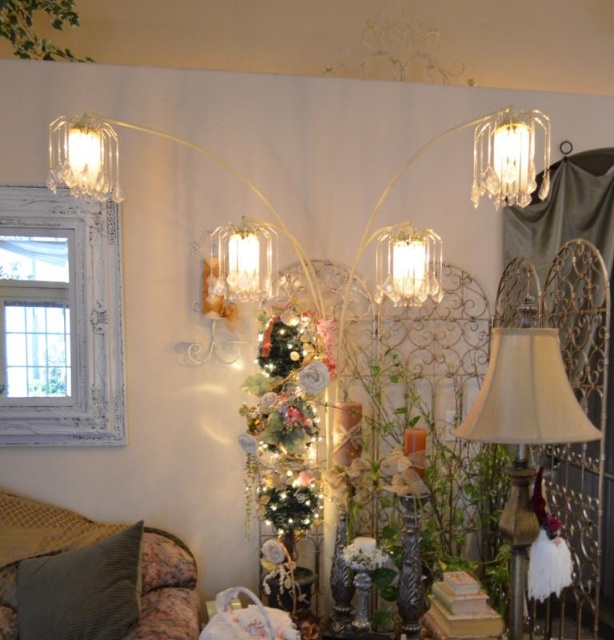
You are arranging a photo shoot in this room and need to place a small camera on the floor between the green corduroy pillow at lower left and the clear glass lampshade at upper left. Based on their positions, will the camera be placed closer to the pillow or the lampshade?

The green corduroy pillow at lower left is positioned under the clear glass lampshade at upper left, so the camera will be closer to the pillow since it is lower in position.

You are arranging flowers in a vase and need to place them between the green corduroy pillow at lower left and the clear glass lampshade at upper left. The vase is 2 feet wide. Will it fit between them?

The distance between the green corduroy pillow at lower left and the clear glass lampshade at upper left is 3.28 feet. Since the vase is 2 feet wide, it will fit between them as there is enough space.